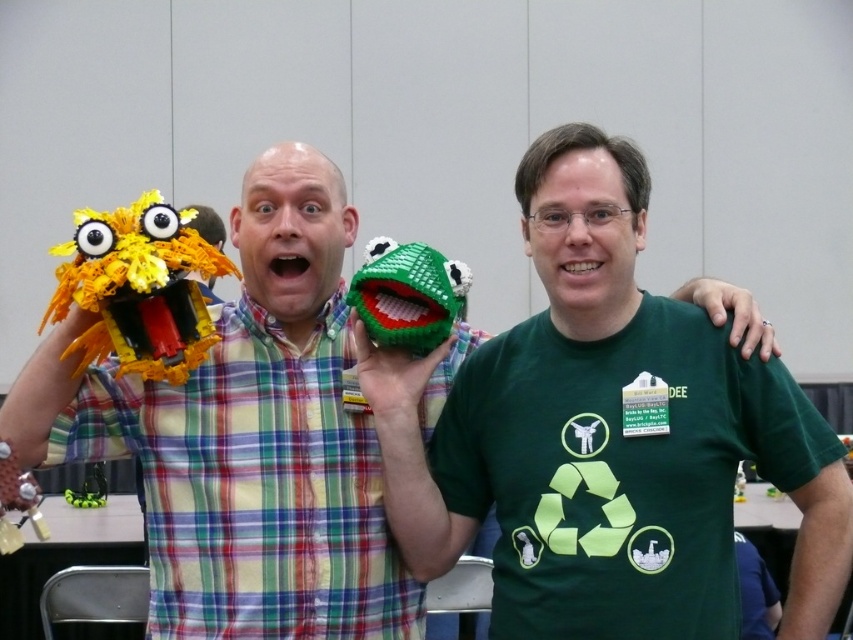
Where is the plastic lego mask at upper center located in the image?

The plastic lego mask at upper center is located at point coordinates of (244, 428).

You are standing in front of the image and want to place a new object at the exact center of the image. However, there is already an object at point (605, 435). What is the name of the object currently occupying that location?

The object at point (605, 435) is the green matte soft toy at center.